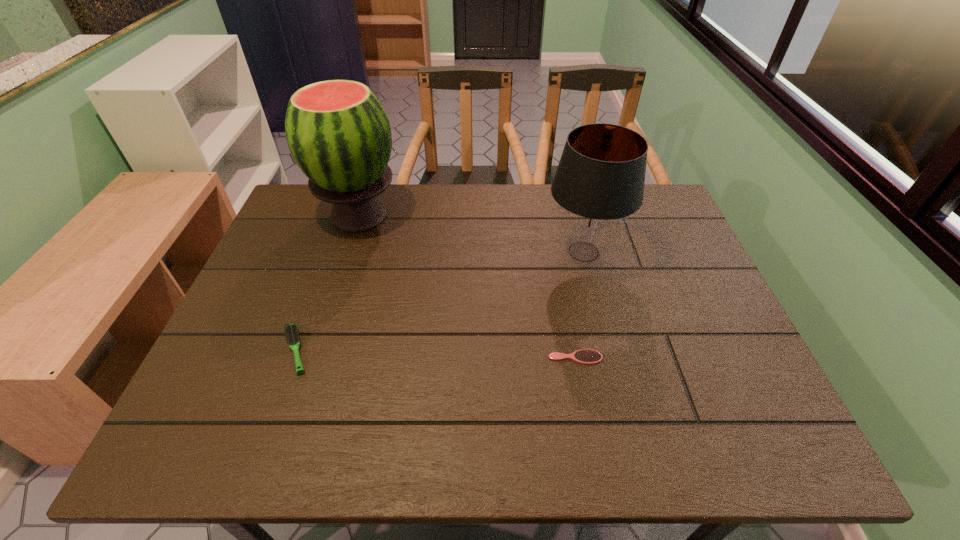
Where is `vacant space at the near right corner of the desktop`? The image size is (960, 540). vacant space at the near right corner of the desktop is located at coordinates (755, 426).

You are a GUI agent. You are given a task and a screenshot of the screen. Output one action in this format:
    pyautogui.click(x=<x>, y=<y>)
    Task: Click on the free space between the lampshade and the left hairbrush
    This screenshot has height=540, width=960.
    Given the screenshot: What is the action you would take?
    pyautogui.click(x=440, y=301)

Where is `vacant point located between the watermelon and the taller hairbrush`? Image resolution: width=960 pixels, height=540 pixels. vacant point located between the watermelon and the taller hairbrush is located at coordinates (327, 283).

The image size is (960, 540). What are the coordinates of `empty space between the lampshade and the watermelon` in the screenshot? It's located at (471, 233).

You are a GUI agent. You are given a task and a screenshot of the screen. Output one action in this format:
    pyautogui.click(x=<x>, y=<y>)
    Task: Click on the vacant region between the lampshade and the taller hairbrush
    
    Given the screenshot: What is the action you would take?
    pyautogui.click(x=440, y=301)

This screenshot has height=540, width=960. What are the coordinates of `empty location between the watermelon and the lampshade` in the screenshot? It's located at (471, 233).

Image resolution: width=960 pixels, height=540 pixels. I want to click on vacant area that lies between the taller hairbrush and the shorter hairbrush, so click(x=436, y=354).

Find the location of a particular element. The image size is (960, 540). free spot between the shortest object and the watermelon is located at coordinates (468, 286).

I want to click on vacant space that is in between the shortest object and the watermelon, so click(468, 286).

I want to click on vacant region between the watermelon and the left hairbrush, so pyautogui.click(x=327, y=283).